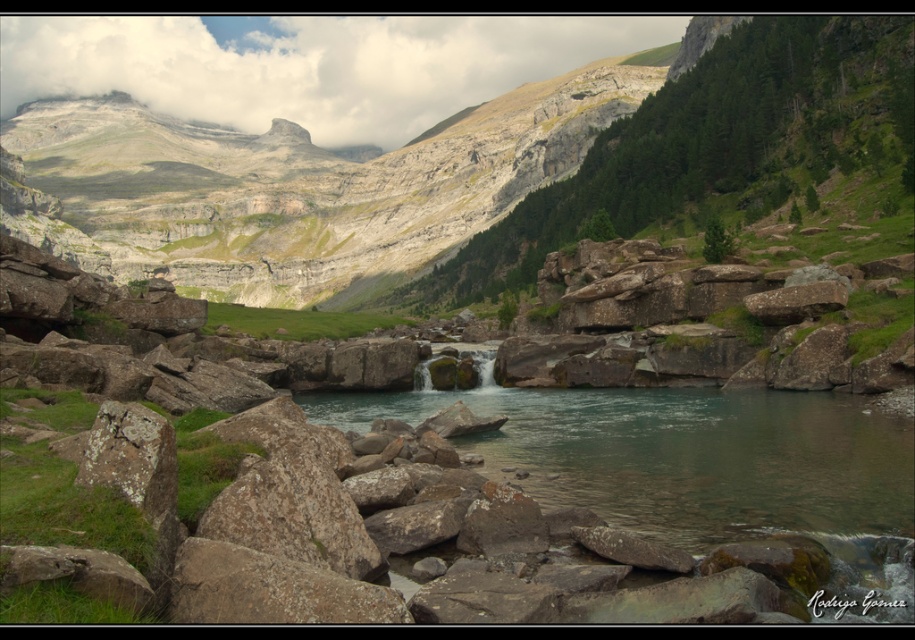
In the scene shown: You are planning a hiking trip and need to cross the river. The rugged stone mountain at center and the clear water at center are in your path. Which object should you avoid stepping on to stay safe?

You should avoid stepping on the rugged stone mountain at center because it has a larger size compared to the clear water at center, making it more stable and safer to walk on. Wait, that seems contradictory. Let me think again. Hmm, the question asks which to avoid stepping on. If the mountain is larger, maybe it is the rocks? Wait, the objects are rugged stone mountain and clear water. So stepping on water isn t safe. The answer should be to avoid the clear water because it s water, but the description s

You are a hiker standing at the edge of the valley looking towards the center of the image. Which object is positioned to the left of the other between the rugged stone mountain at center and the clear water at center?

The rugged stone mountain at center is positioned to the left of the clear water at center.

You are a hiker planning to cross the river in the mountainous landscape. There is a rugged stone mountain at center marked by point [293,188]. Can you safely step on this point to cross the river?

The rugged stone mountain at center is represented by point [293,188]. Since this point is part of the mountain, it is above the river and not submerged, so it is safe to step on this point to cross the river.